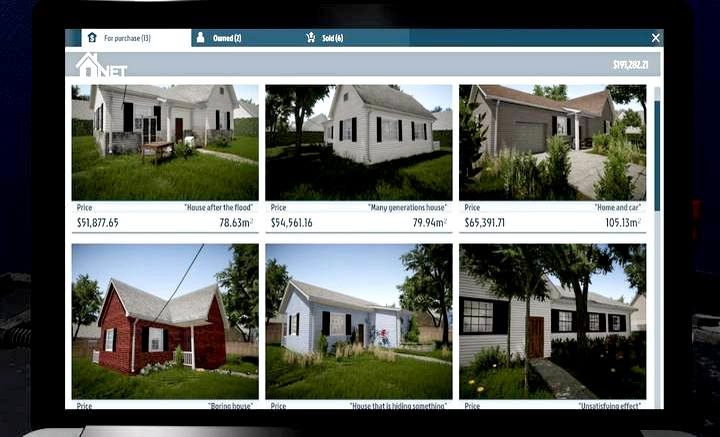
Where is `window`? window is located at coordinates tap(474, 315), tap(564, 317), tap(595, 322), tap(616, 323), tap(384, 128), tap(418, 128), tap(342, 130), tap(328, 130).